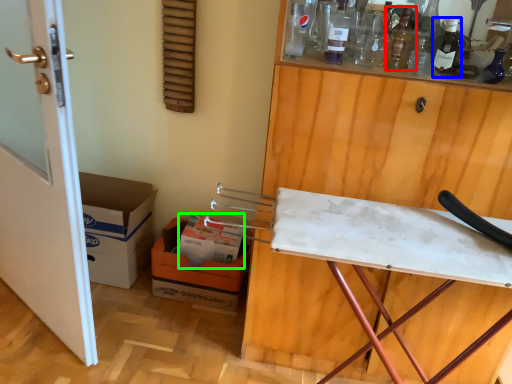
Question: Estimate the real-world distances between objects in this image. Which object is farther from wine bottle (highlighted by a red box), wine bottle (highlighted by a blue box) or box (highlighted by a green box)?

Choices:
 (A) wine bottle
 (B) box

Answer: (B)